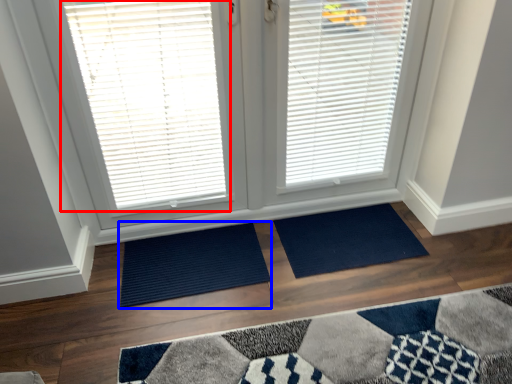
Question: Among these objects, which one is nearest to the camera, window blind (highlighted by a red box) or doormat (highlighted by a blue box)?

Choices:
 (A) window blind
 (B) doormat

Answer: (A)